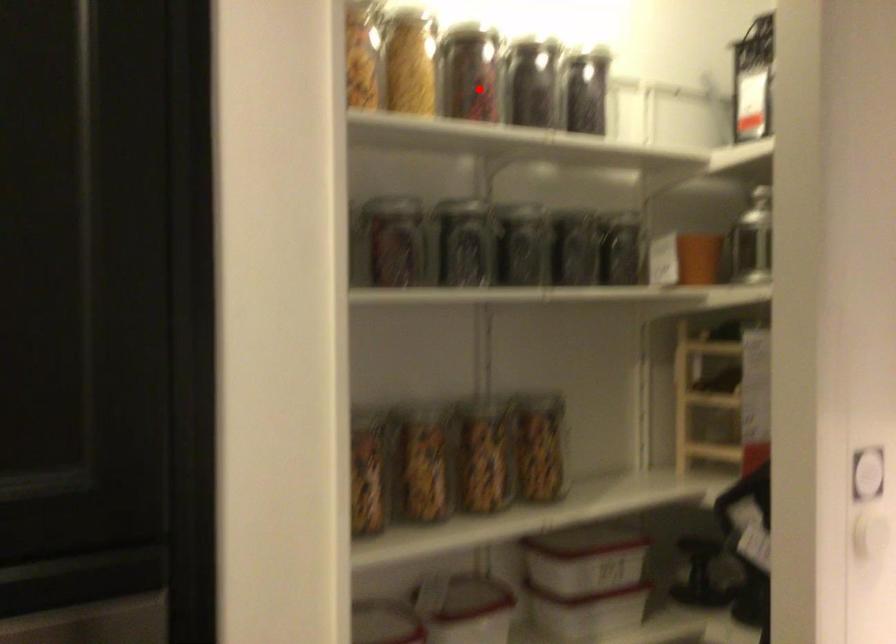
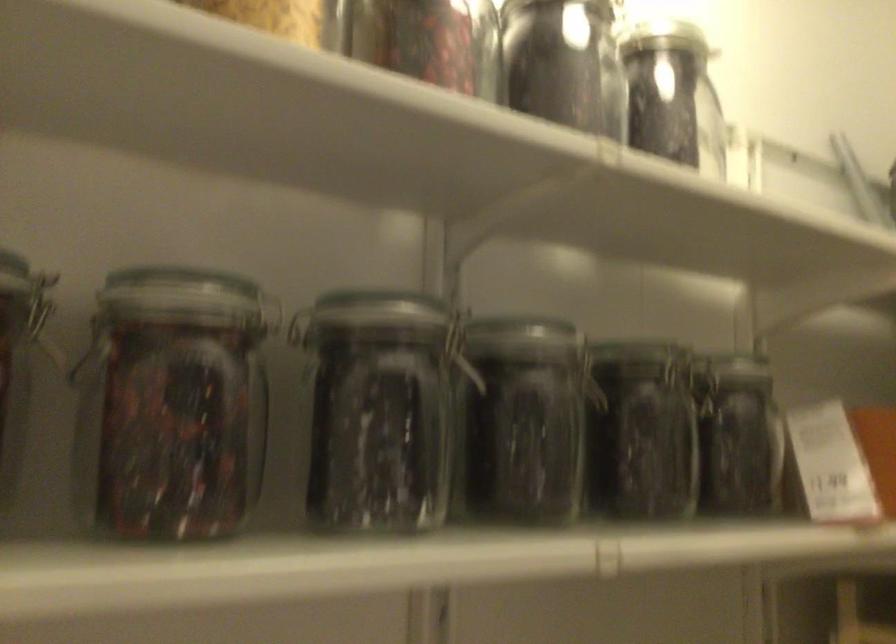
Question: I am providing you with two images of the same scene from different viewpoints. Given a red point in image1, look at the same physical point in image2. Is it:

Choices:
 (A) Closer to the viewpoint
 (B) Farther from the viewpoint

Answer: (A)